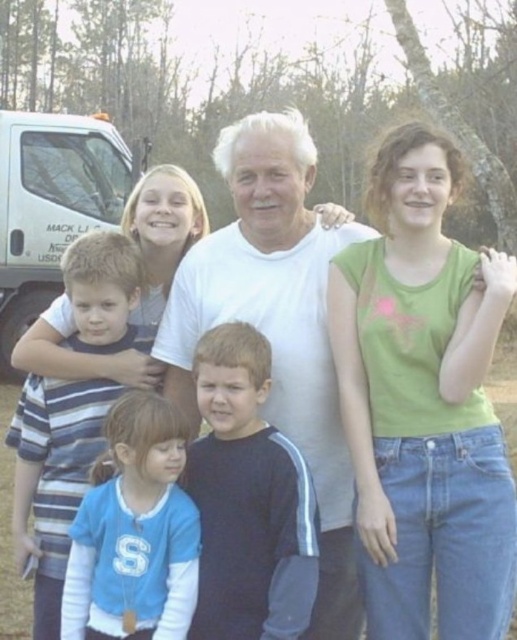
Based on the scene description, can you determine which of the two shirts, the green cotton shirt at right or the white matte shirt at center, is closer to the camera?

The green cotton shirt at right is in front of the white matte shirt at center, so the green cotton shirt at right is closer to the camera.

You are a photographer trying to adjust the lighting for the photo. You notice the blue fleece jacket at lower left and the matte white shirt at upper center. Which object is positioned higher in the image?

The blue fleece jacket at lower left is taller than the matte white shirt at upper center, so the blue fleece jacket at lower left is positioned higher.

You are standing in the park and see the striped cotton shirt at left and the matte white shirt at upper center. Which shirt is nearer to you?

The striped cotton shirt at left is closer to the viewer than the matte white shirt at upper center.